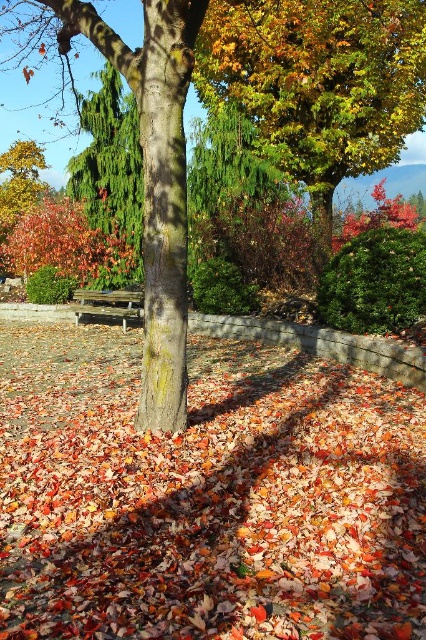
Question: Which of the following is the farthest from the observer?

Choices:
 (A) brown wooden bench at center
 (B) shiny green leaves at upper center

Answer: (A)

Question: Does green textured evergreen tree at left come behind brown wooden bench at center?

Choices:
 (A) yes
 (B) no

Answer: (A)

Question: Which point is farther to the camera?

Choices:
 (A) brown wooden bench at center
 (B) shiny green leaves at upper center

Answer: (A)

Question: Considering the relative positions of shiny green leaves at upper center and green textured evergreen tree at left in the image provided, where is shiny green leaves at upper center located with respect to green textured evergreen tree at left?

Choices:
 (A) below
 (B) above

Answer: (B)

Question: Which object is farther from the camera taking this photo?

Choices:
 (A) green textured evergreen tree at left
 (B) shiny green leaves at upper center
 (C) brown wooden bench at center

Answer: (A)

Question: Is green textured evergreen tree at left smaller than brown wooden bench at center?

Choices:
 (A) no
 (B) yes

Answer: (A)